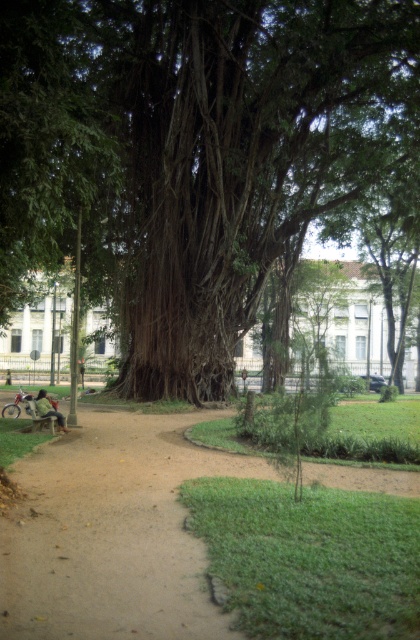
You are standing at the entrance of the park and want to take a photo of both the ancient tree and the young tree. The entrance is located at point [73,630]. You are currently at point [54,406]. To ensure both trees are in your camera frame, which point should you move to?

You should move to point [73,630] because it is closer to the camera than point [54,406], allowing both trees to be in frame.

You are standing at the point with coordinates point (194, 152) in the park. What is the nearest object to you?

The nearest object to you at point (194, 152) is the green leafy tree at center.

You are a person walking along the brown dirt path at lower left and want to sit on the wooden park bench at lower left. Can you reach the bench without leaving the path?

The brown dirt path at lower left is in front of the wooden park bench at lower left, so you can reach the bench by walking forward along the path.